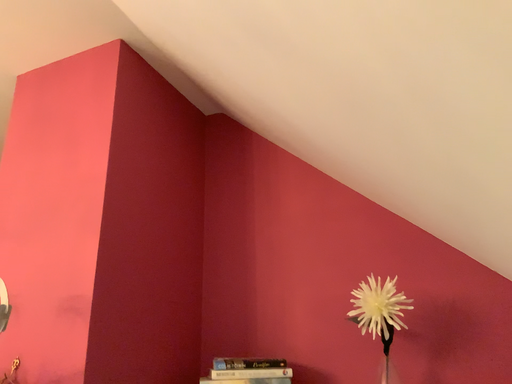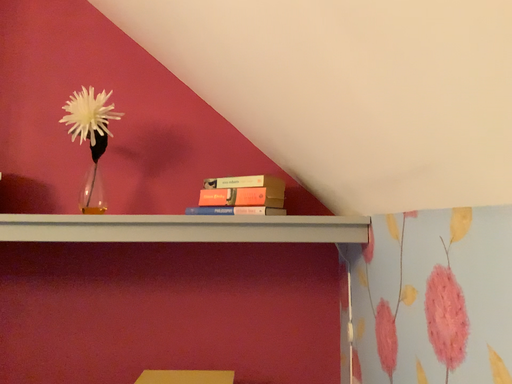
Question: Which way did the camera rotate in the video?

Choices:
 (A) rotated right
 (B) rotated left

Answer: (A)